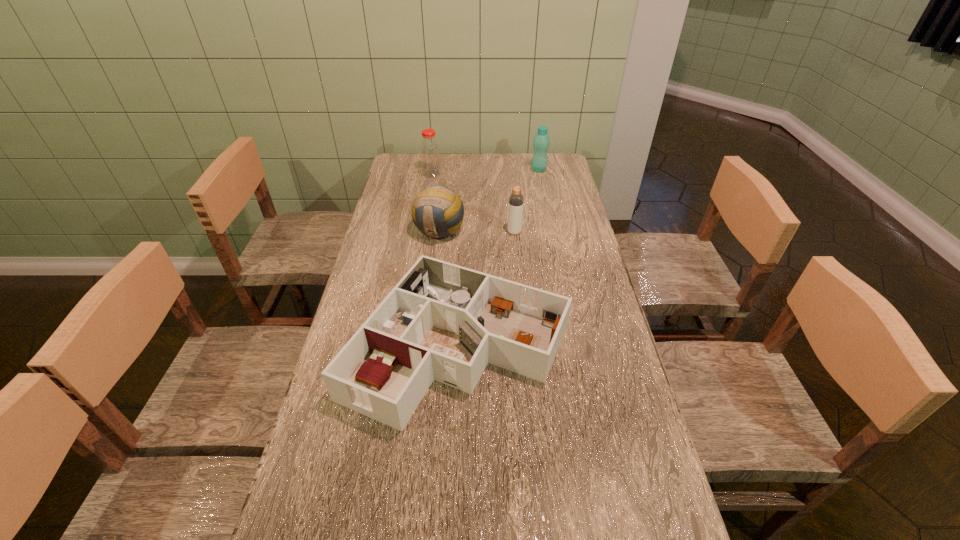
Image resolution: width=960 pixels, height=540 pixels. I want to click on blank area in the image that satisfies the following two spatial constraints: 1. on the front side of the leftmost bottle; 2. on the right side of the nearest object, so click(403, 346).